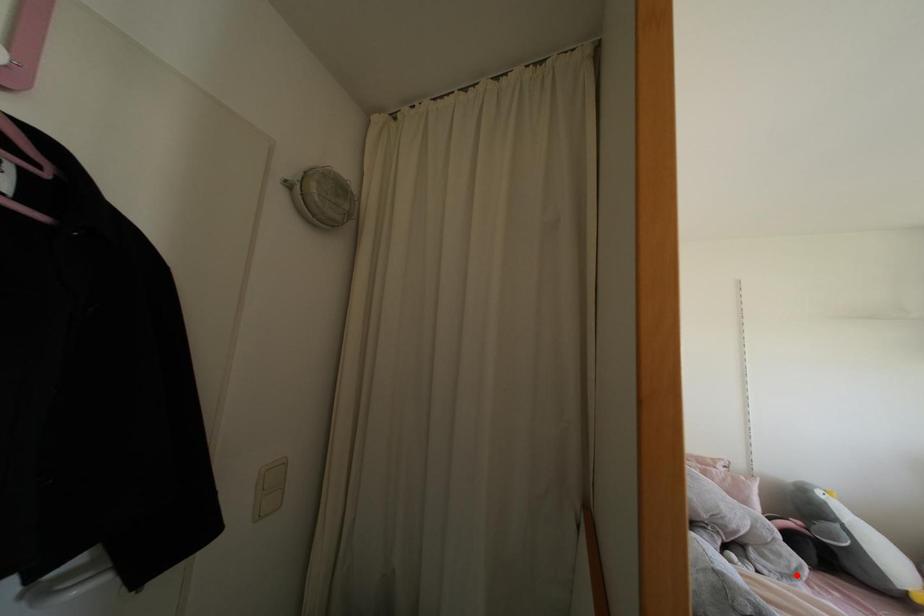
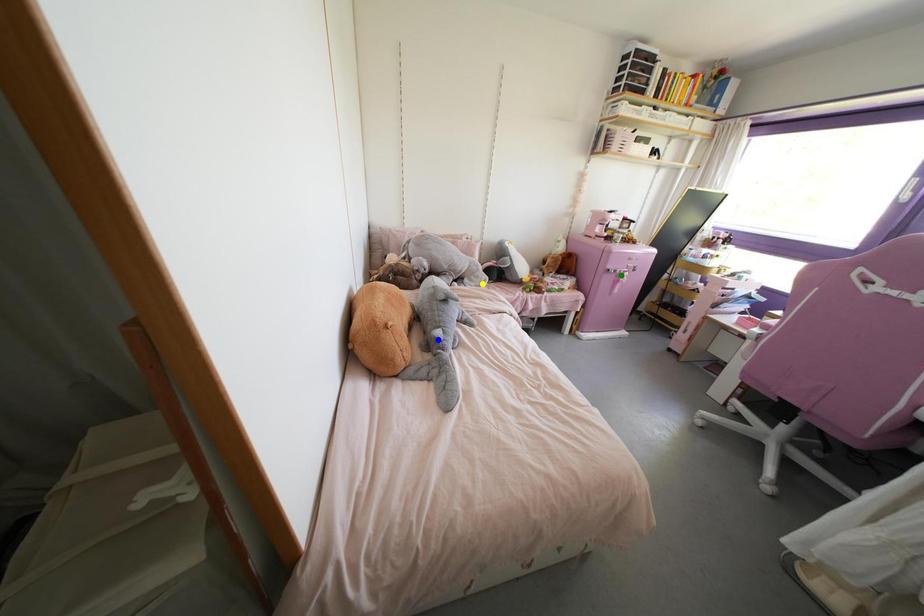
Question: I am providing you with two images of the same scene from different viewpoints. A red point is marked on the first image. You are given multiple points on the second image. Can you choose the point in image 2 that corresponds to the point in image 1?

Choices:
 (A) green point
 (B) yellow point
 (C) blue point

Answer: (B)